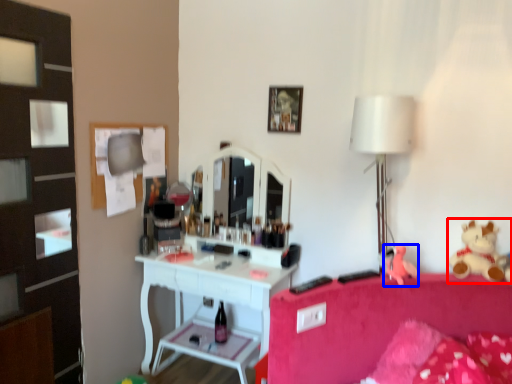
Question: Among these objects, which one is nearest to the camera, teddy bear (highlighted by a red box) or toy (highlighted by a blue box)?

Choices:
 (A) teddy bear
 (B) toy

Answer: (A)